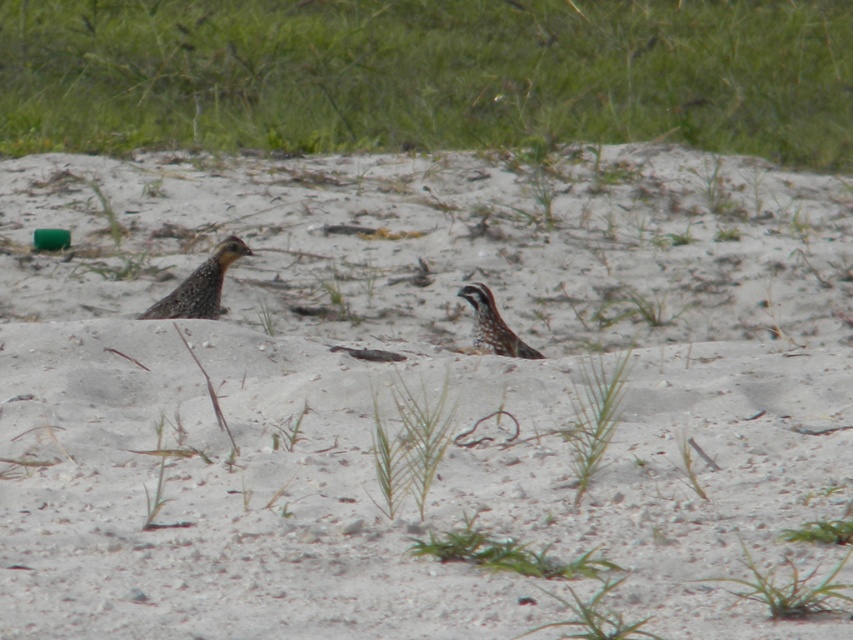
Is point (171, 316) farther from camera compared to point (490, 312)?

That is True.

Which is behind, point (157, 308) or point (492, 340)?

The point (157, 308) is behind.

The image size is (853, 640). In order to click on speckled brown bird at left in this screenshot , I will do `click(200, 285)`.